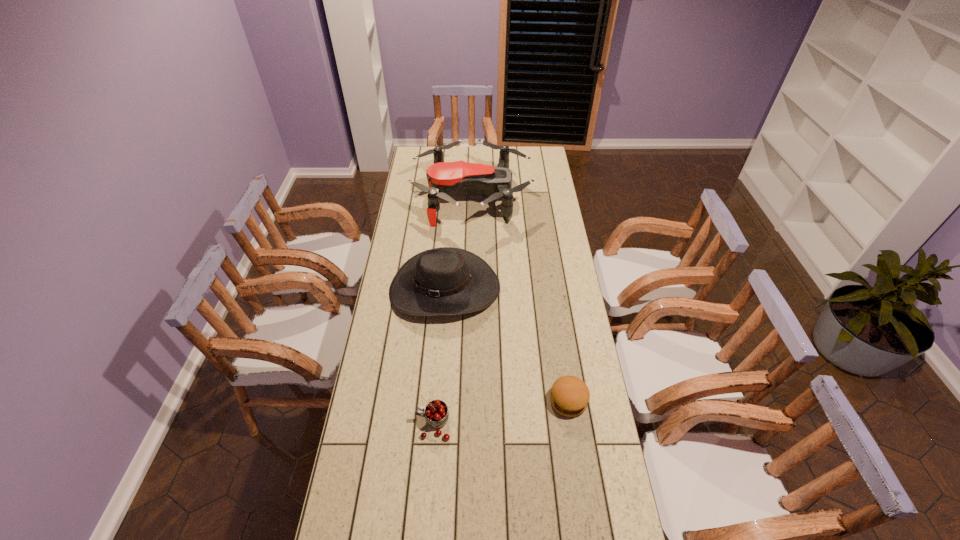
This screenshot has width=960, height=540. In order to click on drone in this screenshot , I will do tap(445, 180).

The image size is (960, 540). What are the coordinates of `cowboy hat` in the screenshot? It's located at (445, 281).

Identify the location of cherry. (436, 415).

Find the location of a particular element. The image size is (960, 540). the shortest object is located at coordinates (569, 396).

Where is `vacant area situated 0.070m on the camera side of the drone`? This screenshot has height=540, width=960. vacant area situated 0.070m on the camera side of the drone is located at coordinates (544, 198).

Locate an element on the screen. This screenshot has height=540, width=960. vacant space located on the front-facing side of the cowboy hat is located at coordinates (438, 378).

The width and height of the screenshot is (960, 540). I want to click on blank area located 0.080m on the handle side of the second shortest object, so click(x=391, y=424).

Identify the location of free space located on the handle side of the second shortest object. Image resolution: width=960 pixels, height=540 pixels. 366,424.

At what (x,y) coordinates should I click in order to perform the action: click on blank space located 0.160m on the handle side of the second shortest object. Please return your answer as a coordinate pair (x, y). The height and width of the screenshot is (540, 960). Looking at the image, I should click on (366, 424).

The image size is (960, 540). In order to click on vacant space located on the left of the shortest object in this screenshot , I will do `click(471, 401)`.